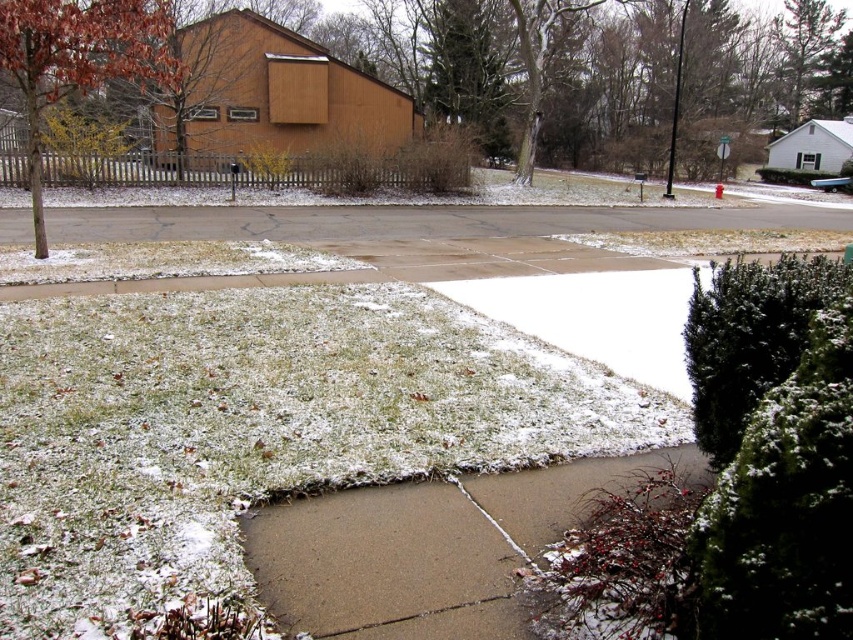
How distant is brown concrete sidewalk at lower center from reddish-brown bark tree at left?

brown concrete sidewalk at lower center is 8.93 meters from reddish-brown bark tree at left.

Is point (339, 572) positioned behind point (32, 97)?

That is False.

Is point (459, 637) positioned in front of point (119, 77)?

Yes.

At what (x,y) coordinates should I click in order to perform the action: click on brown concrete sidewalk at lower center. Please return your answer as a coordinate pair (x, y). This screenshot has height=640, width=853. Looking at the image, I should click on (427, 548).